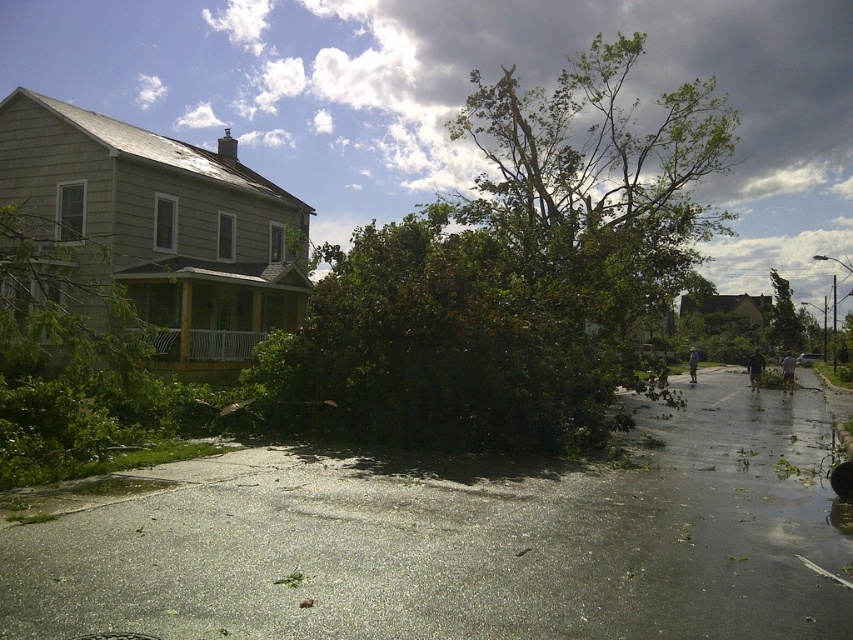
Question: Can you confirm if green leafy tree at center is positioned above green leafy tree at right?

Choices:
 (A) no
 (B) yes

Answer: (B)

Question: Does green leafy tree at center appear over green leafy tree at right?

Choices:
 (A) no
 (B) yes

Answer: (B)

Question: Which of the following is the closest to the observer?

Choices:
 (A) (566, 104)
 (B) (793, 348)

Answer: (A)

Question: Can you confirm if green leafy tree at center is positioned to the right of green leafy tree at right?

Choices:
 (A) no
 (B) yes

Answer: (A)